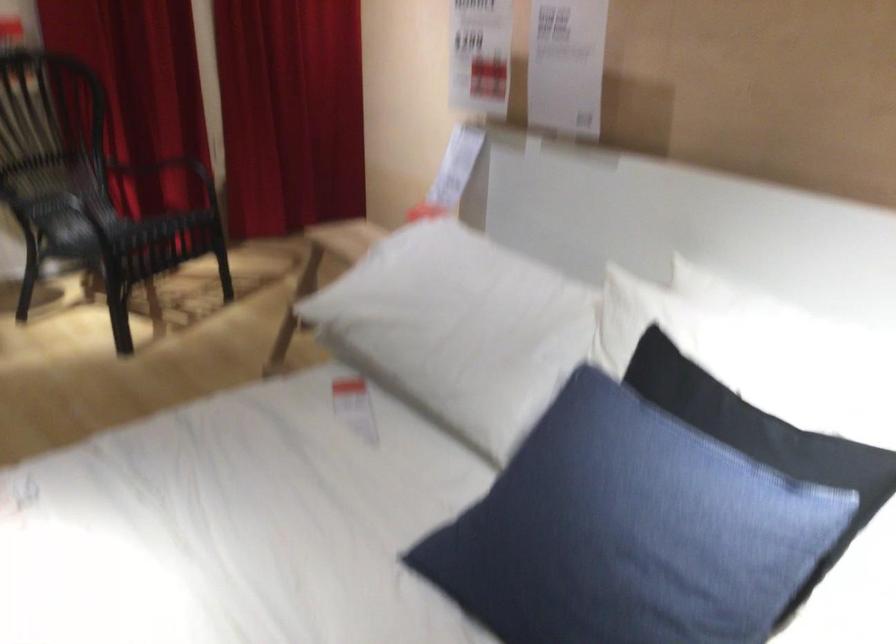
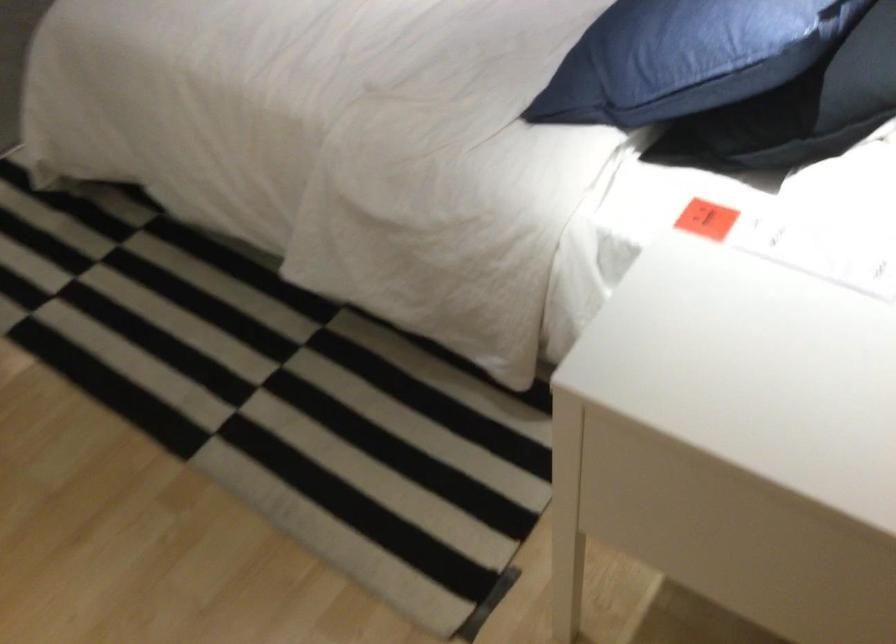
In the second image, find the point that corresponds to [819,545] in the first image.

(808, 108)